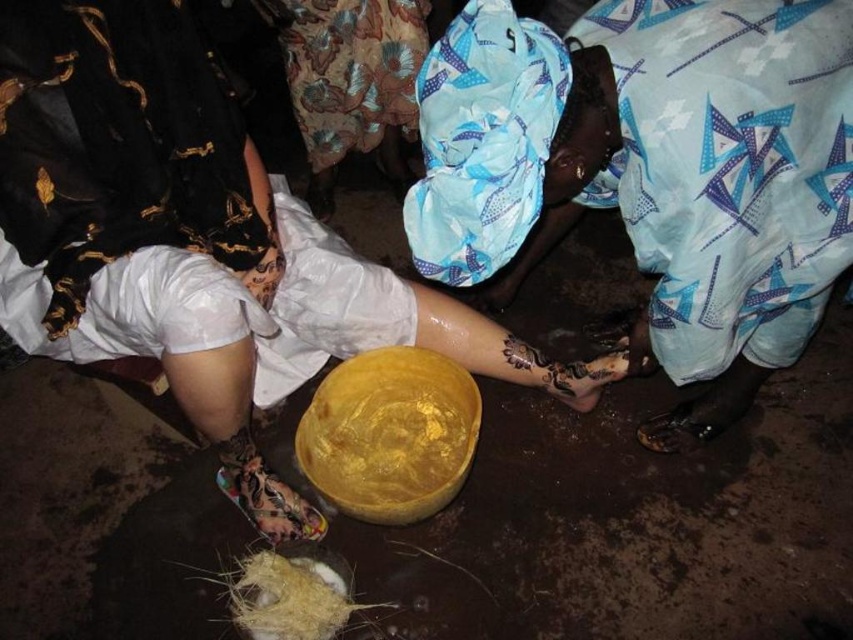
Question: Which is farther from the blue printed fabric at center?

Choices:
 (A) yellow matte bowl at center
 (B) straw nest at lower center
 (C) golden matte bowl at center

Answer: (B)

Question: Is blue printed fabric at center further to the viewer compared to yellow matte bowl at center?

Choices:
 (A) no
 (B) yes

Answer: (A)

Question: Is blue printed fabric at center above blue printed fabric at upper center?

Choices:
 (A) no
 (B) yes

Answer: (A)

Question: Considering the real-world distances, which object is farthest from the yellow matte bowl at center?

Choices:
 (A) blue printed fabric at upper center
 (B) straw nest at lower center
 (C) golden matte bowl at center
 (D) blue printed fabric at center

Answer: (A)

Question: Among these objects, which one is farthest from the camera?

Choices:
 (A) blue printed fabric at upper center
 (B) blue printed fabric at center
 (C) golden matte bowl at center

Answer: (A)

Question: Is yellow matte bowl at center below golden matte bowl at center?

Choices:
 (A) yes
 (B) no

Answer: (B)